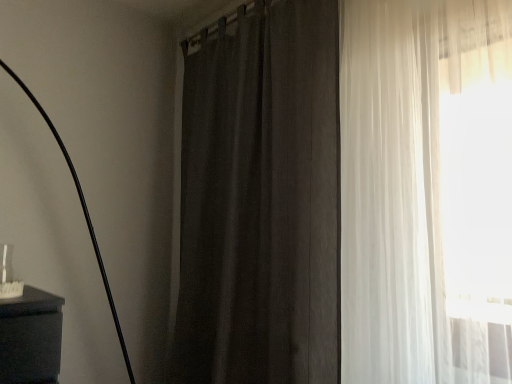
From the picture: Measure the distance between dark gray fabric shower curtain at center and camera.

1.41 meters.

Find the location of `dark gray fabric shower curtain at center`. dark gray fabric shower curtain at center is located at coordinates (261, 201).

What do you see at coordinates (261, 201) in the screenshot? The width and height of the screenshot is (512, 384). I see `dark gray fabric shower curtain at center` at bounding box center [261, 201].

Locate an element on the screen. dark gray fabric shower curtain at center is located at coordinates (261, 201).